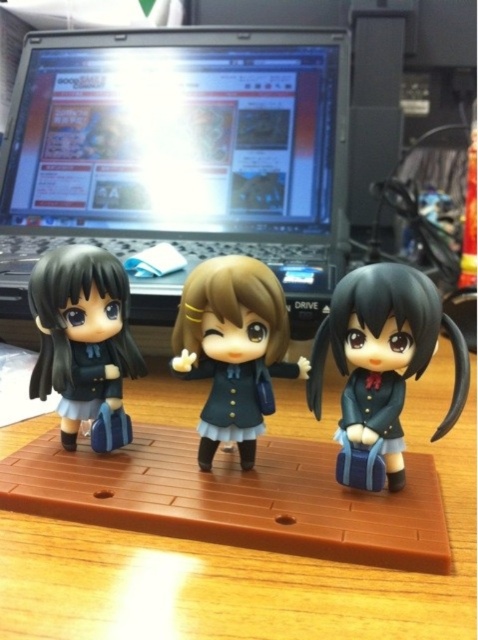
Can you confirm if black glossy laptop at upper center is wider than brown plastic table at center?

No, black glossy laptop at upper center is not wider than brown plastic table at center.

The width and height of the screenshot is (478, 640). What do you see at coordinates (180, 150) in the screenshot?
I see `black glossy laptop at upper center` at bounding box center [180, 150].

Does point (205, 252) come in front of point (226, 630)?

No.

Where is `black glossy laptop at upper center`? This screenshot has height=640, width=478. black glossy laptop at upper center is located at coordinates (180, 150).

Between point (182, 76) and point (421, 352), which one is positioned in front?

Point (421, 352) is more forward.

Which is above, black glossy laptop at upper center or matte black doll at right?

Positioned higher is black glossy laptop at upper center.

Identify the location of black glossy laptop at upper center. (180, 150).

Between brown plastic table at center and matte black doll at right, which one has less height?

brown plastic table at center

Can you confirm if brown plastic table at center is wider than matte black doll at right?

Correct, the width of brown plastic table at center exceeds that of matte black doll at right.

Is point (14, 596) closer to viewer compared to point (314, 396)?

Yes, it is in front of point (314, 396).

You are a GUI agent. You are given a task and a screenshot of the screen. Output one action in this format:
    pyautogui.click(x=<x>, y=<y>)
    Task: Click on the brown plastic table at center
    
    Given the screenshot: What is the action you would take?
    pyautogui.click(x=249, y=566)